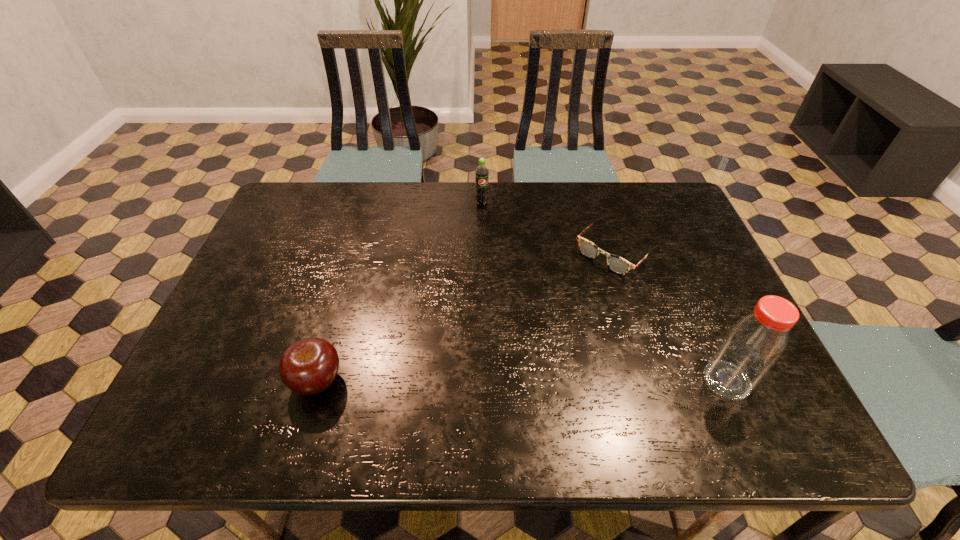
Image resolution: width=960 pixels, height=540 pixels. Identify the location of free spot between the bottle and the apple. (522, 381).

You are a GUI agent. You are given a task and a screenshot of the screen. Output one action in this format:
    pyautogui.click(x=<x>, y=<y>)
    Task: Click on the free spot between the bottle and the apple
    The width and height of the screenshot is (960, 540).
    Given the screenshot: What is the action you would take?
    pyautogui.click(x=522, y=381)

Identify the location of free spot between the second tallest object and the apple. The image size is (960, 540). (399, 292).

This screenshot has height=540, width=960. In order to click on empty location between the farthest object and the second shortest object in this screenshot , I will do `click(399, 292)`.

Where is `unoccupied area between the bottle and the second shortest object`? The width and height of the screenshot is (960, 540). unoccupied area between the bottle and the second shortest object is located at coordinates (522, 381).

Locate an element on the screen. free point between the second shortest object and the tallest object is located at coordinates (522, 381).

At what (x,y) coordinates should I click in order to perform the action: click on free space between the soda and the third tallest object. Please return your answer as a coordinate pair (x, y). The width and height of the screenshot is (960, 540). Looking at the image, I should click on (399, 292).

This screenshot has height=540, width=960. Identify the location of empty space between the tallest object and the third object from right to left. coord(605,292).

At what (x,y) coordinates should I click in order to perform the action: click on free space between the tallest object and the second tallest object. Please return your answer as a coordinate pair (x, y). This screenshot has height=540, width=960. Looking at the image, I should click on (605, 292).

Select which object appears as the third closest to the second shortest object. Please provide its 2D coordinates. Your answer should be formatted as a tuple, i.e. [(x, y)], where the tuple contains the x and y coordinates of a point satisfying the conditions above.

[(752, 346)]